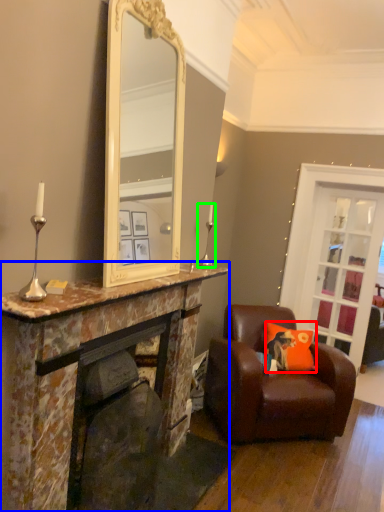
Question: Which object is the closest to the cushion (highlighted by a red box)? Choose among these: cabinetry (highlighted by a blue box) or candle holder (highlighted by a green box).

Choices:
 (A) cabinetry
 (B) candle holder

Answer: (B)